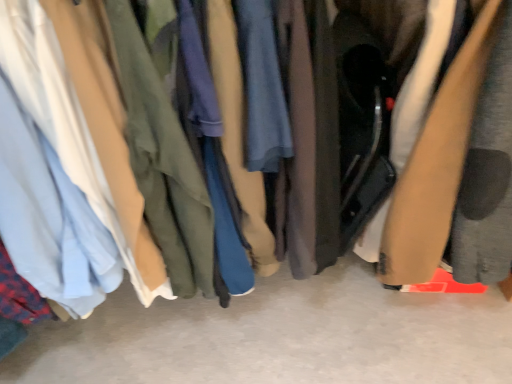
In order to face matte beige sweater at center, should I rotate leftwards or rightwards?

Turn right approximately 27.876 degrees to face it.

What do you see at coordinates (458, 162) in the screenshot? I see `matte beige sweater at center` at bounding box center [458, 162].

Find the location of a particular element. This screenshot has height=384, width=512. matte beige sweater at center is located at coordinates (458, 162).

Where is `matte beige sweater at center`? This screenshot has height=384, width=512. matte beige sweater at center is located at coordinates (458, 162).